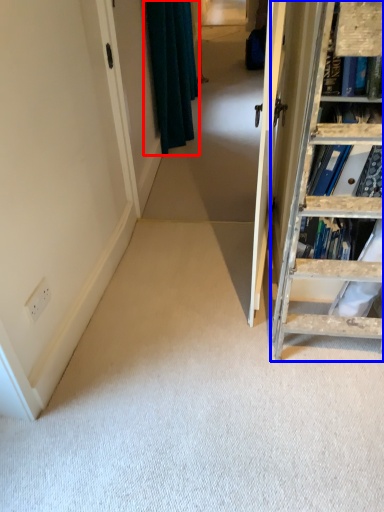
Question: Which object is further to the camera taking this photo, curtain (highlighted by a red box) or ladder (highlighted by a blue box)?

Choices:
 (A) curtain
 (B) ladder

Answer: (A)